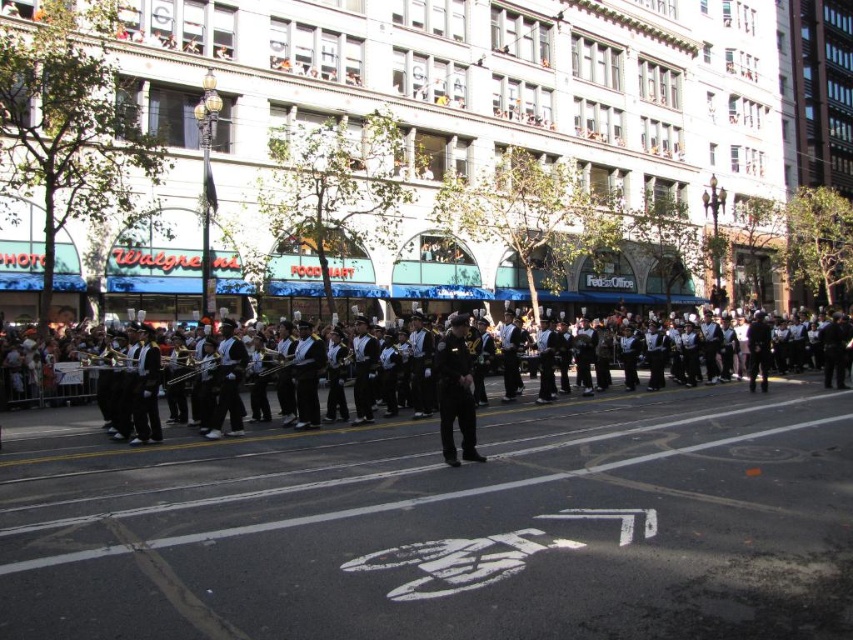
Which is above, black uniformed band at center or shiny silver trumpet at center?

shiny silver trumpet at center

Consider the image. Between black uniformed band at center and shiny silver trumpet at center, which one has more height?

With more height is black uniformed band at center.

The width and height of the screenshot is (853, 640). I want to click on black uniformed band at center, so coord(85,436).

Can you confirm if black uniformed band at center is positioned to the right of black uniform at center?

Yes, black uniformed band at center is to the right of black uniform at center.

Who is positioned more to the right, black uniformed band at center or black uniform at center?

Positioned to the right is black uniformed band at center.

Identify the location of black uniformed band at center. Image resolution: width=853 pixels, height=640 pixels. (85, 436).

At what (x,y) coordinates should I click in order to perform the action: click on black uniformed band at center. Please return your answer as a coordinate pair (x, y). Image resolution: width=853 pixels, height=640 pixels. Looking at the image, I should click on (85, 436).

Which is more to the left, black uniform at center or shiny silver trumpet at center?

shiny silver trumpet at center is more to the left.

In order to click on black uniform at center in this screenshot , I will do `click(456, 392)`.

Locate an element on the screen. Image resolution: width=853 pixels, height=640 pixels. black uniform at center is located at coordinates (456, 392).